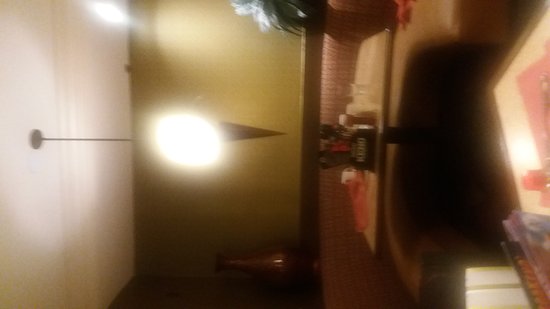
Identify the location of pot. This screenshot has height=309, width=550. point(273,265).